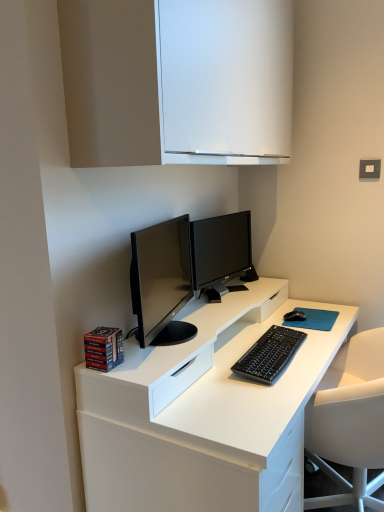
Question: From a real-world perspective, is white matte cabinet at upper center positioned above or below black matte keyboard at center?

Choices:
 (A) above
 (B) below

Answer: (A)

Question: Relative to black matte keyboard at center, is white matte cabinet at upper center in front or behind?

Choices:
 (A) behind
 (B) front

Answer: (B)

Question: Considering the real-world distances, which object is farthest from the hardcover book at lower left?

Choices:
 (A) black matte mouse at right
 (B) satin black monitor at center
 (C) white glossy desk at center
 (D) white matte cabinet at upper center
 (E) black matte keyboard at center

Answer: (A)

Question: Based on their relative distances, which object is farther from the black matte keyboard at center?

Choices:
 (A) white glossy desk at center
 (B) hardcover book at lower left
 (C) white matte cabinet at upper center
 (D) black matte mouse at right
 (E) satin black monitor at center

Answer: (C)